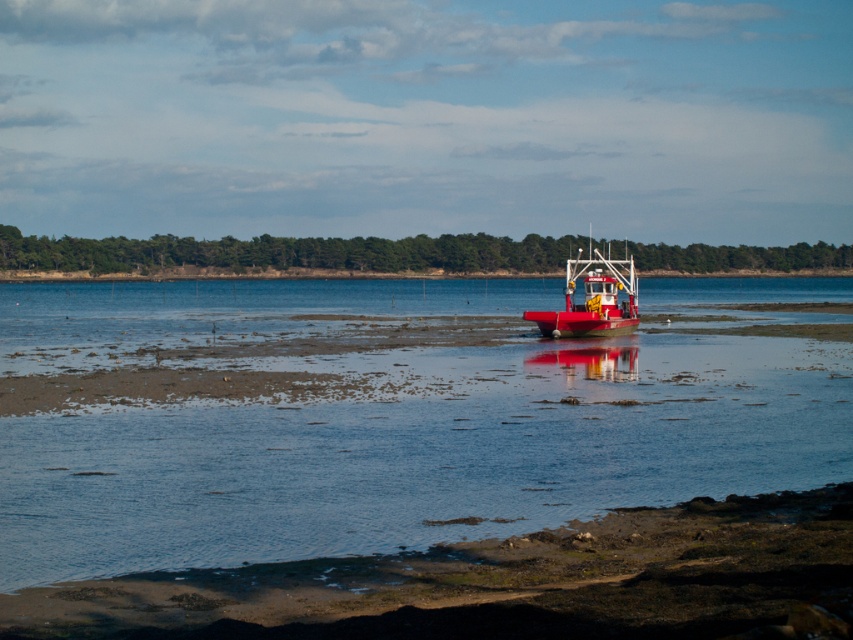
Question: Estimate the real-world distances between objects in this image. Which object is farther from the brown sandy mud at lower center?

Choices:
 (A) shiny red boat at center
 (B) clear water at center

Answer: (A)

Question: Does brown sandy mud at lower center lie in front of shiny red boat at center?

Choices:
 (A) yes
 (B) no

Answer: (A)

Question: Does brown sandy mud at lower center have a larger size compared to shiny red boat at center?

Choices:
 (A) yes
 (B) no

Answer: (B)

Question: Which object appears closest to the camera in this image?

Choices:
 (A) shiny red boat at center
 (B) clear water at center
 (C) brown sandy mud at lower center

Answer: (C)

Question: Which of the following is the closest to the observer?

Choices:
 (A) (521, 381)
 (B) (776, 627)
 (C) (605, 328)

Answer: (B)

Question: Can you confirm if clear water at center is bigger than brown sandy mud at lower center?

Choices:
 (A) no
 (B) yes

Answer: (B)